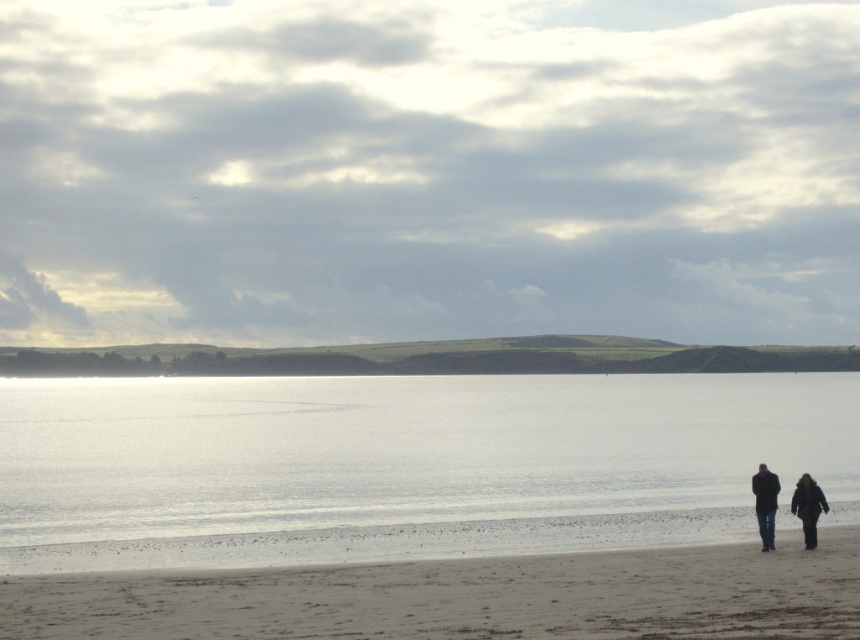
You are standing on the beach and see two points marked on the image. Which point, point (x=550, y=611) or point (x=778, y=484), is closer to you?

Point (x=550, y=611) is closer to the camera than point (x=778, y=484), so it is closer to you.

You are a photographer carrying a tripod that requires a 5 inch gap to set up. You see the dark brown leather jacket at lower right and the black matte coat at lower right. Is there enough space between them to place your tripod?

The distance between the dark brown leather jacket at lower right and the black matte coat at lower right is 4.87 inches, which is slightly less than the required 5 inches. Therefore, there isn not enough space to place the tripod between them.